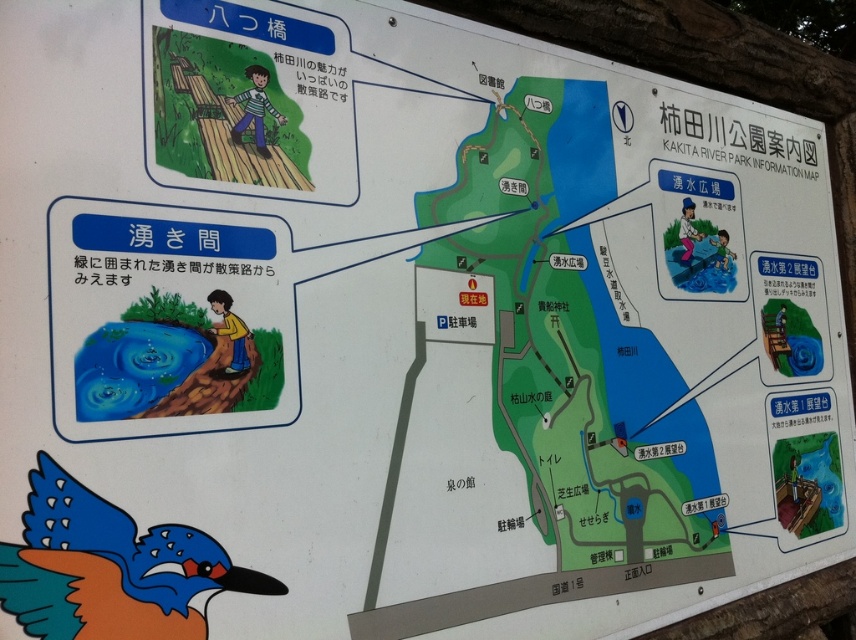
Who is lower down, blue glossy kingfisher at lower left or wooden bridge at upper left?

blue glossy kingfisher at lower left

Which is in front, point (201, 632) or point (259, 93)?

Point (201, 632)

Find the location of a particular element. The width and height of the screenshot is (856, 640). blue glossy kingfisher at lower left is located at coordinates (110, 568).

You are a GUI agent. You are given a task and a screenshot of the screen. Output one action in this format:
    pyautogui.click(x=<x>, y=<y>)
    Task: Click on the blue glossy kingfisher at lower left
    Image resolution: width=856 pixels, height=640 pixels.
    Given the screenshot: What is the action you would take?
    pyautogui.click(x=110, y=568)

Who is taller, blue glossy water at lower left or wooden bridge at upper left?

With more height is blue glossy water at lower left.

Is the position of blue glossy water at lower left more distant than that of wooden bridge at upper left?

No.

What do you see at coordinates (162, 316) in the screenshot?
I see `blue glossy water at lower left` at bounding box center [162, 316].

This screenshot has width=856, height=640. In order to click on blue glossy water at lower left in this screenshot , I will do click(162, 316).

I want to click on blue glossy water at lower left, so click(162, 316).

At what (x,y) coordinates should I click in order to perform the action: click on blue glossy water at lower left. Please return your answer as a coordinate pair (x, y). The height and width of the screenshot is (640, 856). Looking at the image, I should click on (162, 316).